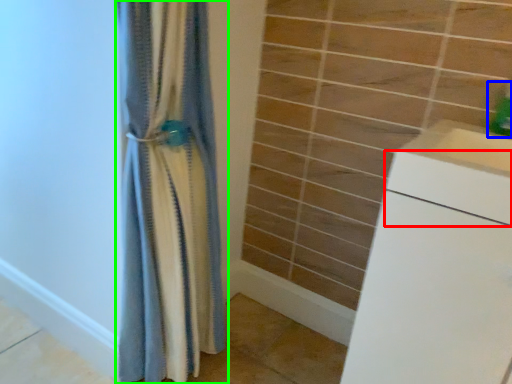
Question: Based on their relative distances, which object is nearer to drawer (highlighted by a red box)? Choose from soap dispenser (highlighted by a blue box) and curtain (highlighted by a green box).

Choices:
 (A) soap dispenser
 (B) curtain

Answer: (A)